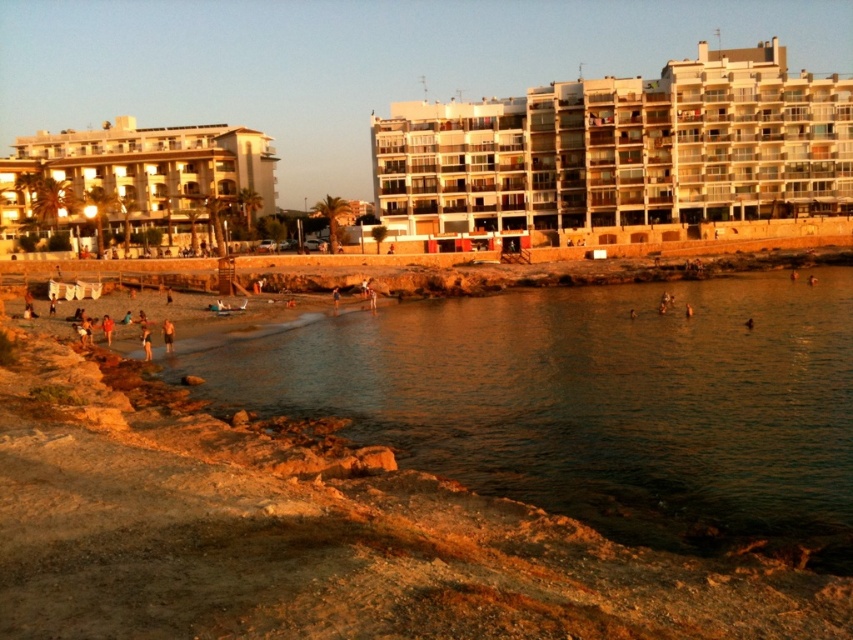
Describe the element at coordinates (619, 152) in the screenshot. I see `beige concrete building at upper right` at that location.

Which is behind, point (534, 218) or point (109, 324)?

Point (534, 218)

Between point (561, 124) and point (103, 326), which one is positioned behind?

Point (561, 124)

Identify the location of beige concrete building at upper right. The image size is (853, 640). (619, 152).

Is shiny brown water at lower center bigger than light brown sand at lower left?

Yes.

Which of these two, shiny brown water at lower center or light brown sand at lower left, stands taller?

With more height is shiny brown water at lower center.

This screenshot has width=853, height=640. What do you see at coordinates (596, 403) in the screenshot?
I see `shiny brown water at lower center` at bounding box center [596, 403].

This screenshot has width=853, height=640. I want to click on shiny brown water at lower center, so click(x=596, y=403).

Is matte beige building at upper left wider than light brown sand at beach center?

Correct, the width of matte beige building at upper left exceeds that of light brown sand at beach center.

Consider the image. Does matte beige building at upper left have a lesser width compared to light brown sand at beach center?

No.

Who is more distant from viewer, (80, 138) or (164, 337)?

The point (80, 138) is behind.

Identify the location of matte beige building at upper left. click(x=137, y=182).